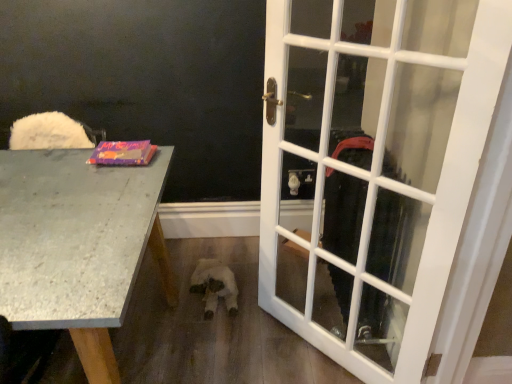
The width and height of the screenshot is (512, 384). Find the location of `vacant area situated to the left side of white glass door at right`. vacant area situated to the left side of white glass door at right is located at coordinates (246, 343).